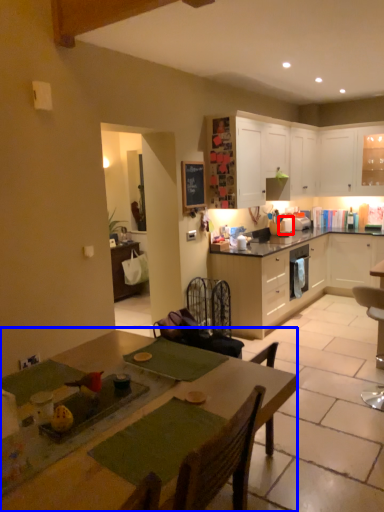
Question: Which point is closer to the camera, appliance (highlighted by a red box) or table (highlighted by a blue box)?

Choices:
 (A) appliance
 (B) table

Answer: (B)